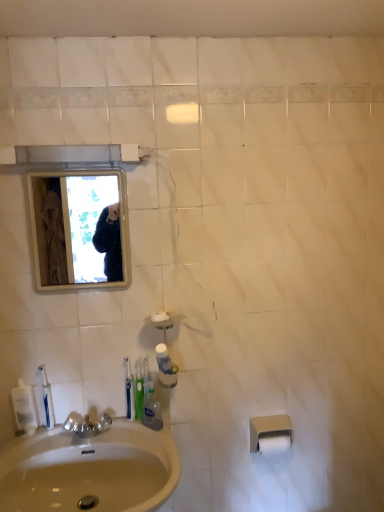
Question: Is clear plastic mouthwash at lower left, the 3th mouthwash when ordered from right to left, touching clear plastic mouthwash at lower left, the 2th mouthwash when ordered from left to right?

Choices:
 (A) no
 (B) yes

Answer: (B)

Question: Is clear plastic mouthwash at lower left, the 3th mouthwash when ordered from right to left, to the right of clear plastic mouthwash at lower left, the second mouthwash from the right, from the viewer's perspective?

Choices:
 (A) yes
 (B) no

Answer: (B)

Question: Is clear plastic mouthwash at lower left, the second mouthwash from the right, a part of clear plastic mouthwash at lower left, the 3th mouthwash when ordered from right to left?

Choices:
 (A) no
 (B) yes

Answer: (A)

Question: From the image's perspective, is clear plastic mouthwash at lower left, marked as the first mouthwash in a left-to-right arrangement, under clear plastic mouthwash at lower left, the second mouthwash from the right?

Choices:
 (A) yes
 (B) no

Answer: (A)

Question: Can you confirm if clear plastic mouthwash at lower left, marked as the first mouthwash in a left-to-right arrangement, is smaller than clear plastic mouthwash at lower left, the 2th mouthwash when ordered from left to right?

Choices:
 (A) yes
 (B) no

Answer: (B)

Question: Is clear plastic mouthwash at lower left, marked as the first mouthwash in a left-to-right arrangement, wider or thinner than white matte toilet paper at lower right, which appears as the second toilet paper when viewed from the top?

Choices:
 (A) thin
 (B) wide

Answer: (A)

Question: From the image's perspective, is clear plastic mouthwash at lower left, marked as the first mouthwash in a left-to-right arrangement, above or below white matte toilet paper at lower right, marked as the first toilet paper in a bottom-to-top arrangement?

Choices:
 (A) below
 (B) above

Answer: (B)

Question: Considering the positions of clear plastic mouthwash at lower left, the 3th mouthwash when ordered from right to left, and white matte toilet paper at lower right, marked as the first toilet paper in a bottom-to-top arrangement, in the image, is clear plastic mouthwash at lower left, the 3th mouthwash when ordered from right to left, taller or shorter than white matte toilet paper at lower right, marked as the first toilet paper in a bottom-to-top arrangement,?

Choices:
 (A) short
 (B) tall

Answer: (B)

Question: Is point (34, 402) closer or farther from the camera than point (266, 436)?

Choices:
 (A) farther
 (B) closer

Answer: (B)

Question: From a real-world perspective, is clear plastic mouthwash at lower left, the 2th mouthwash when ordered from left to right, positioned above or below white glossy mirror at upper left?

Choices:
 (A) above
 (B) below

Answer: (B)

Question: Relative to white glossy mirror at upper left, is clear plastic mouthwash at lower left, the 2th mouthwash when ordered from left to right, in front or behind?

Choices:
 (A) front
 (B) behind

Answer: (B)

Question: Based on their sizes in the image, would you say clear plastic mouthwash at lower left, the 2th mouthwash when ordered from left to right, is bigger or smaller than white glossy mirror at upper left?

Choices:
 (A) big
 (B) small

Answer: (B)

Question: Considering the relative positions of clear plastic mouthwash at lower left, the second mouthwash from the right, and white glossy mirror at upper left in the image provided, is clear plastic mouthwash at lower left, the second mouthwash from the right, to the left or to the right of white glossy mirror at upper left?

Choices:
 (A) left
 (B) right

Answer: (A)

Question: In terms of width, does green plastic toothbrush at sink, the second toothbrush in the left-to-right sequence, look wider or thinner when compared to beige matte toilet paper at lower right, positioned as the first toilet paper in top-to-bottom order?

Choices:
 (A) wide
 (B) thin

Answer: (B)

Question: From the image's perspective, is green plastic toothbrush at sink, the first toothbrush when ordered from right to left, above or below beige matte toilet paper at lower right, positioned as the first toilet paper in top-to-bottom order?

Choices:
 (A) above
 (B) below

Answer: (A)